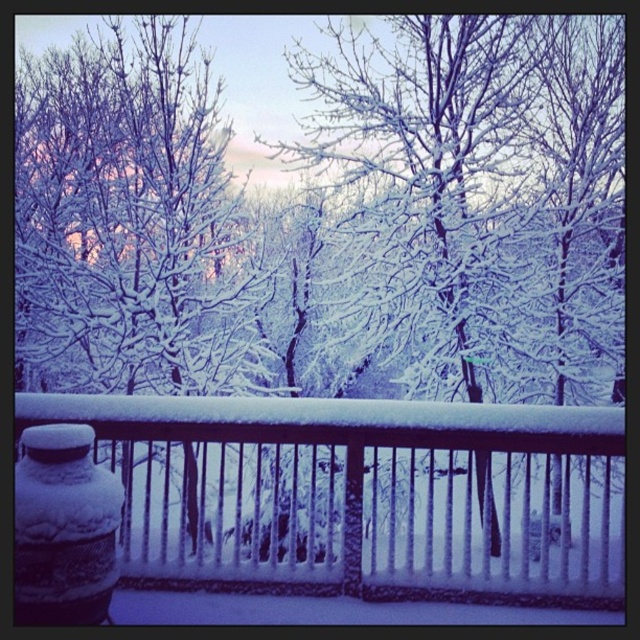
Where is `snow-covered wooden railing at lower center`? This screenshot has width=640, height=640. snow-covered wooden railing at lower center is located at coordinates (328, 497).

Is snow-covered wooden railing at lower center below white frosty tree at center?

Yes, snow-covered wooden railing at lower center is below white frosty tree at center.

Locate an element on the screen. The image size is (640, 640). snow-covered wooden railing at lower center is located at coordinates (328, 497).